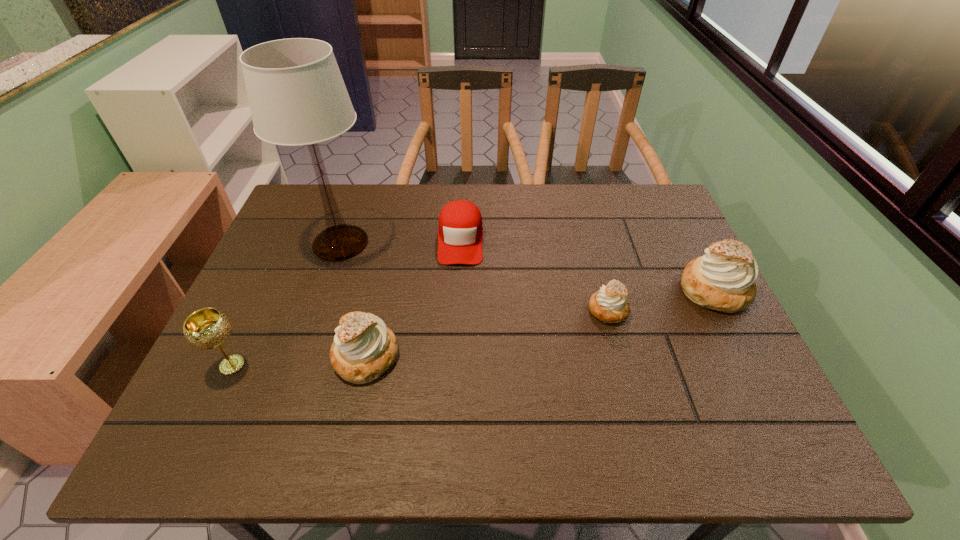
This screenshot has height=540, width=960. In order to click on blank space located 0.070m on the left of the rightmost object in this screenshot , I will do `click(653, 290)`.

Where is `free space located above the cylindrical shade of the tallest object`? This screenshot has width=960, height=540. free space located above the cylindrical shade of the tallest object is located at coordinates (446, 243).

At what (x,y) coordinates should I click in order to perform the action: click on free space located on the front-facing side of the baseball cap. Please return your answer as a coordinate pair (x, y). This screenshot has height=540, width=960. Looking at the image, I should click on pyautogui.click(x=458, y=299).

This screenshot has width=960, height=540. Identify the location of vacant region located 0.060m on the back of the chalice. 250,329.

Where is `table lamp present at the far edge`? table lamp present at the far edge is located at coordinates (297, 96).

Identify the location of baseball cap that is at the far edge. This screenshot has width=960, height=540. [460, 234].

Locate an element on the screen. The image size is (960, 540). pastry located at the near edge is located at coordinates (363, 349).

The image size is (960, 540). Identify the location of chalice present at the near edge. (207, 328).

Image resolution: width=960 pixels, height=540 pixels. Find the location of `table lamp that is positioned at the left edge`. table lamp that is positioned at the left edge is located at coordinates (297, 96).

What are the coordinates of `chalice at the left edge` in the screenshot? It's located at tap(207, 328).